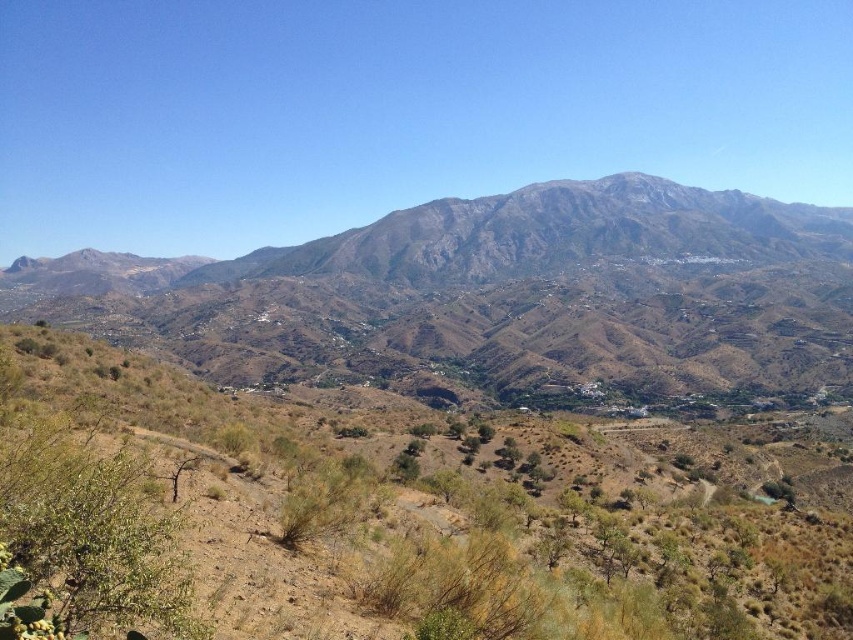
You are an explorer trying to navigate through the dry shrubbery at center and the rugged brown mountain range at center. Which of these two features is taller?

The dry shrubbery at center is not as tall as the rugged brown mountain range at center, so the rugged brown mountain range at center is taller.

You are standing at the camera position observing the landscape. There are two points marked in the image, point 1 at coordinates point (202, 493) and point 2 at coordinates point (537, 221). Which point is closer to you?

Point (202, 493) is closer to the camera than point (537, 221).